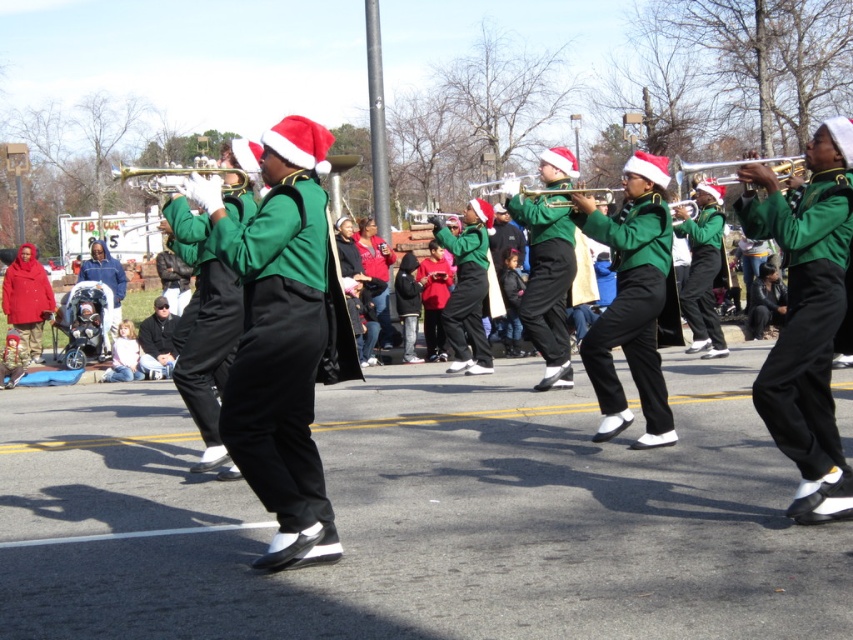
You are a photographer at the event and want to take a photo that includes both the matte red coat at left and the matte green trumpet at center. Based on their positions, which object should you focus on first to ensure both are in the frame?

Since the matte red coat at left is to the left of the matte green trumpet at center, you should focus on the matte red coat at left first to ensure both are in the frame.

You are a photographer standing at the edge of the crowd, and you want to take a photo that includes both the matte red coat at left and the matte green trumpet at center. Given that your camera has a maximum focus range of 8 meters, can you capture both subjects in the same frame without moving your position?

The matte red coat at left and the matte green trumpet at center are 7.86 meters apart, which is within the camera maximum focus range of 8 meters. Therefore, you can capture both subjects in the same frame without moving your position.